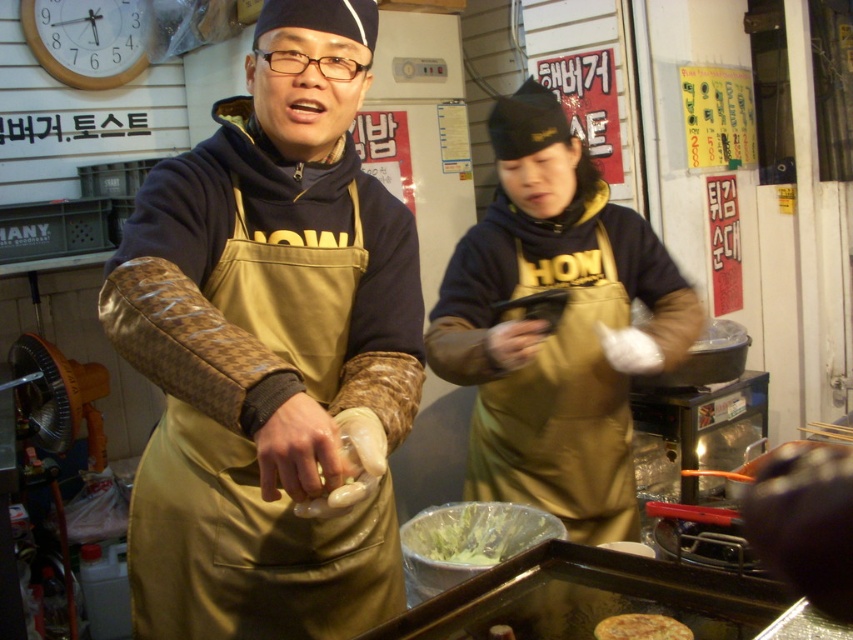
Which is above, brown leather apron at center or gold leather apron at center?

gold leather apron at center is higher up.

Between point (297, 385) and point (570, 422), which one is positioned behind?

Point (570, 422)

Where is `brown leather apron at center`? Image resolution: width=853 pixels, height=640 pixels. brown leather apron at center is located at coordinates (270, 349).

At what (x,y) coordinates should I click in order to perform the action: click on brown leather apron at center. Please return your answer as a coordinate pair (x, y). Looking at the image, I should click on (270, 349).

Does brown leather apron at center appear on the left side of green leafy vegetables in plastic bag at center?

Yes, brown leather apron at center is to the left of green leafy vegetables in plastic bag at center.

Does point (294, 115) come farther from viewer compared to point (463, 524)?

No, (294, 115) is closer to viewer.

Image resolution: width=853 pixels, height=640 pixels. I want to click on brown leather apron at center, so click(x=270, y=349).

Does point (445, 554) lie behind point (637, 624)?

Yes, point (445, 554) is behind point (637, 624).

Who is shorter, green leafy vegetables in plastic bag at center or golden crispy pancake at center?

Standing shorter between the two is golden crispy pancake at center.

Does point (426, 512) come farther from viewer compared to point (612, 630)?

Yes.

What are the coordinates of `green leafy vegetables in plastic bag at center` in the screenshot? It's located at (474, 532).